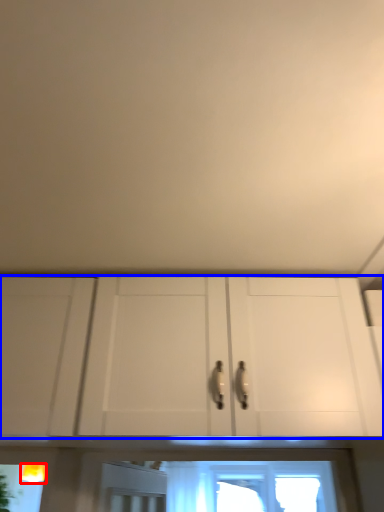
Question: Which point is further to the camera, light fixture (highlighted by a red box) or cabinetry (highlighted by a blue box)?

Choices:
 (A) light fixture
 (B) cabinetry

Answer: (A)